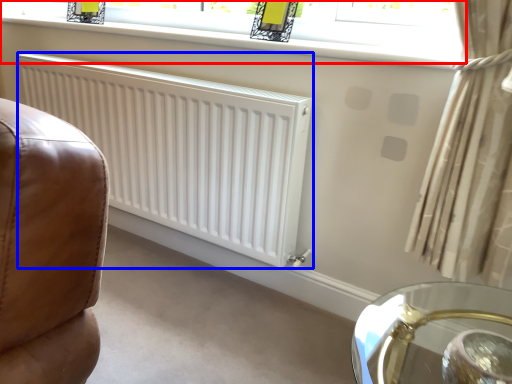
Question: Which of the following is the farthest to the observer, window (highlighted by a red box) or radiator (highlighted by a blue box)?

Choices:
 (A) window
 (B) radiator

Answer: (B)